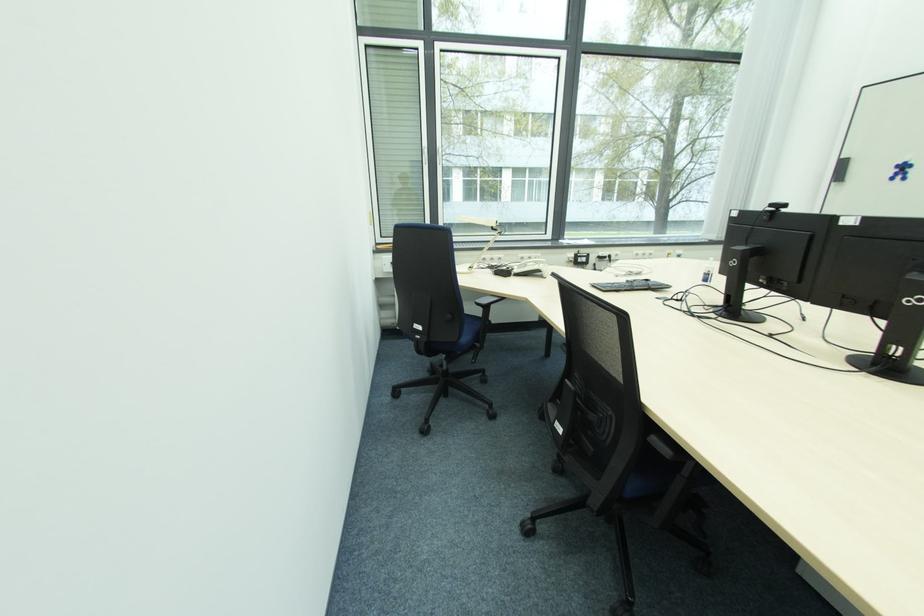
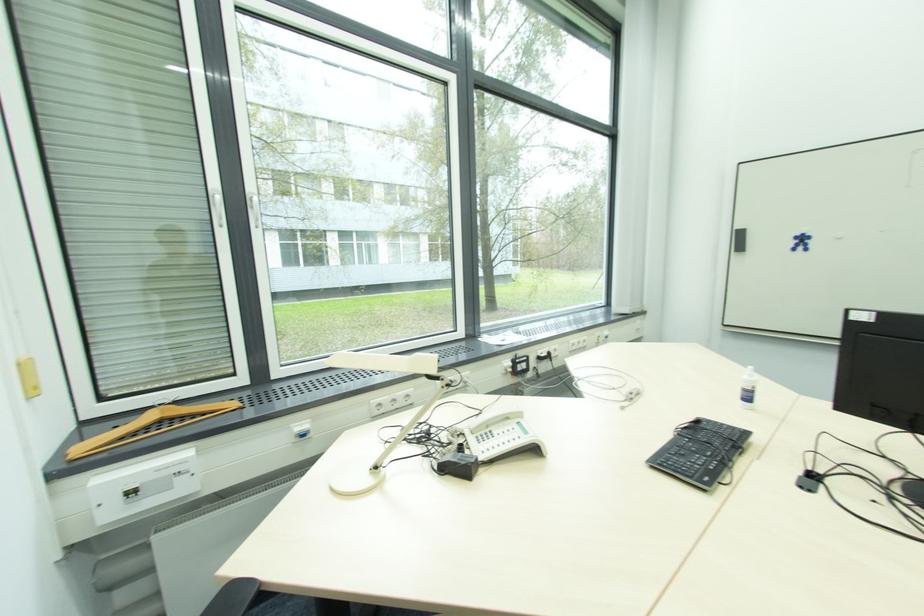
Find the pixel in the second image that matches pixel 846 160 in the first image.

(739, 230)